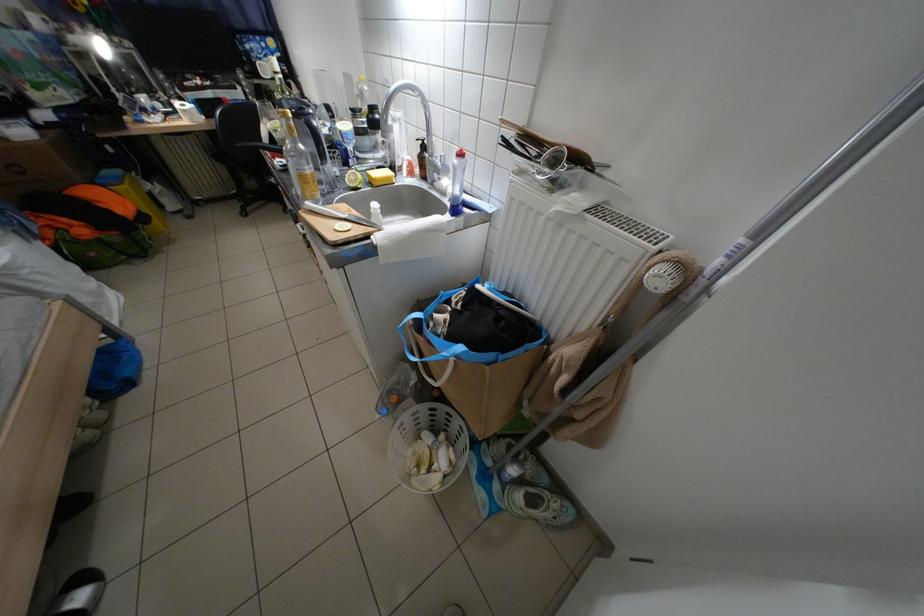
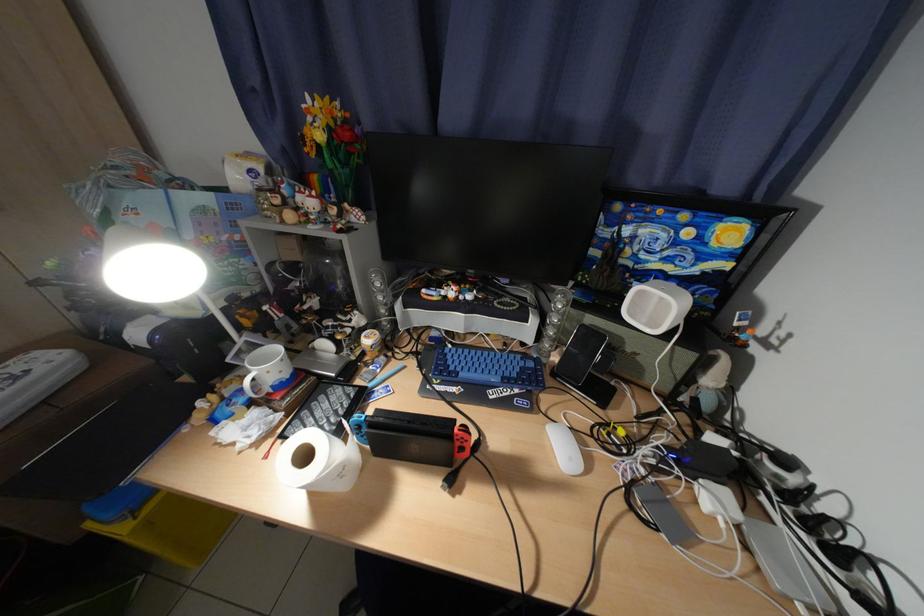
Find the pixel in the second image that matches the point at 259,47 in the first image.

(638, 233)